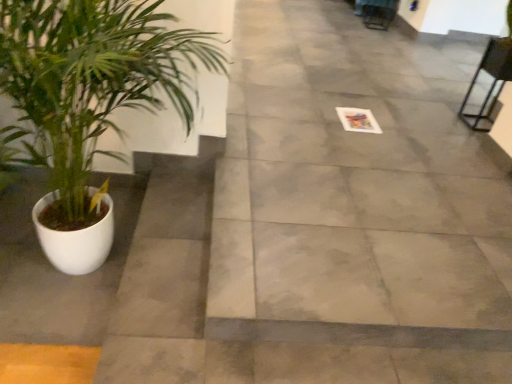
Question: Which is correct: green leafy plant at left is inside metallic black chair at upper right, or outside of it?

Choices:
 (A) inside
 (B) outside

Answer: (B)

Question: Relative to metallic black chair at upper right, is green leafy plant at left in front or behind?

Choices:
 (A) behind
 (B) front

Answer: (B)

Question: Estimate the real-world distances between objects in this image. Which object is farther from the green leafy plant at left?

Choices:
 (A) gray concrete pavement at center
 (B) metallic black chair at upper right

Answer: (B)

Question: Based on their relative distances, which object is nearer to the metallic black chair at upper right?

Choices:
 (A) green leafy plant at left
 (B) gray concrete pavement at center

Answer: (B)